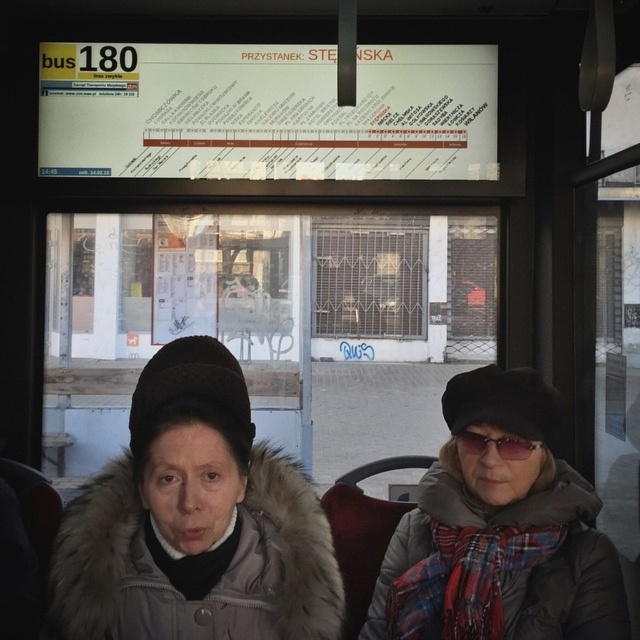
Who is shorter, plaid scarf at center or sunglasses at center?

Standing shorter between the two is sunglasses at center.

Is plaid scarf at center positioned before sunglasses at center?

Yes, it is.

Is point (428, 506) closer to camera compared to point (458, 435)?

No, (428, 506) is behind (458, 435).

Locate an element on the screen. The image size is (640, 640). plaid scarf at center is located at coordinates (499, 532).

Describe the element at coordinates (195, 522) in the screenshot. I see `fur-lined coat at center` at that location.

Is fur-lined coat at center taller than plaid scarf at center?

In fact, fur-lined coat at center may be shorter than plaid scarf at center.

Does point (342, 611) come in front of point (525, 518)?

Yes, it is.

At what (x,y) coordinates should I click in order to perform the action: click on fur-lined coat at center. Please return your answer as a coordinate pair (x, y). Looking at the image, I should click on (195, 522).

Which is behind, point (291, 545) or point (496, 436)?

Positioned behind is point (496, 436).

Does fur-lined coat at center lie in front of sunglasses at center?

That is True.

Is point (170, 419) closer to camera compared to point (534, 445)?

That is True.

This screenshot has height=640, width=640. What are the coordinates of `fur-lined coat at center` in the screenshot? It's located at (195, 522).